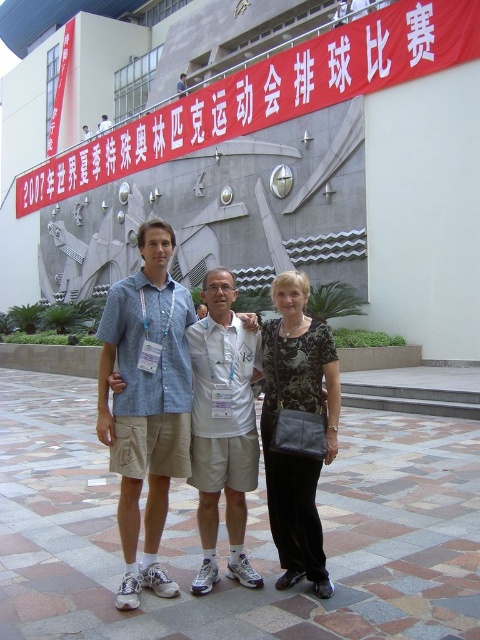
You are a photographer trying to capture a clear photo of the light blue denim shorts at center without the white paper banner at upper center blocking it. Is this possible given their positions?

The light blue denim shorts at center is in front of the white paper banner at upper center, so the banner will block the shorts in the photo.

You are a photographer at the event and need to position yourself so that both the matte white shirt at center and the white paper banner at upper center are clearly visible in your shot. Given their positions, where should you place your camera relative to the subjects?

The matte white shirt at center is below the white paper banner at upper center, so positioning the camera at a lower angle facing upwards would ensure both the matte white shirt at center and the white paper banner at upper center are in clear view.